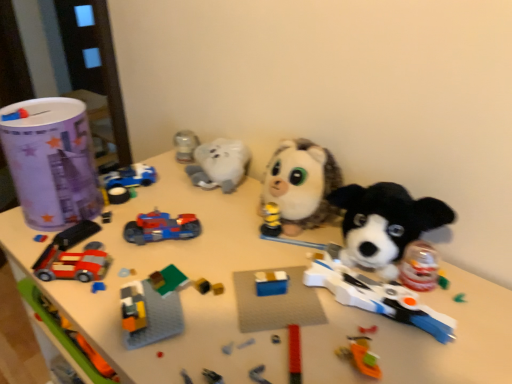
You are a GUI agent. You are given a task and a screenshot of the screen. Output one action in this format:
    pyautogui.click(x=<x>, y=<y>)
    Task: Click on the vacant space in between fluffy white plush at center, placed as the 5th toy when sorted from left to right, and blue plastic car at upper left, positioned as the 3th toy in left-to-right order
    Image resolution: width=512 pixels, height=384 pixels.
    Given the screenshot: What is the action you would take?
    pyautogui.click(x=194, y=205)